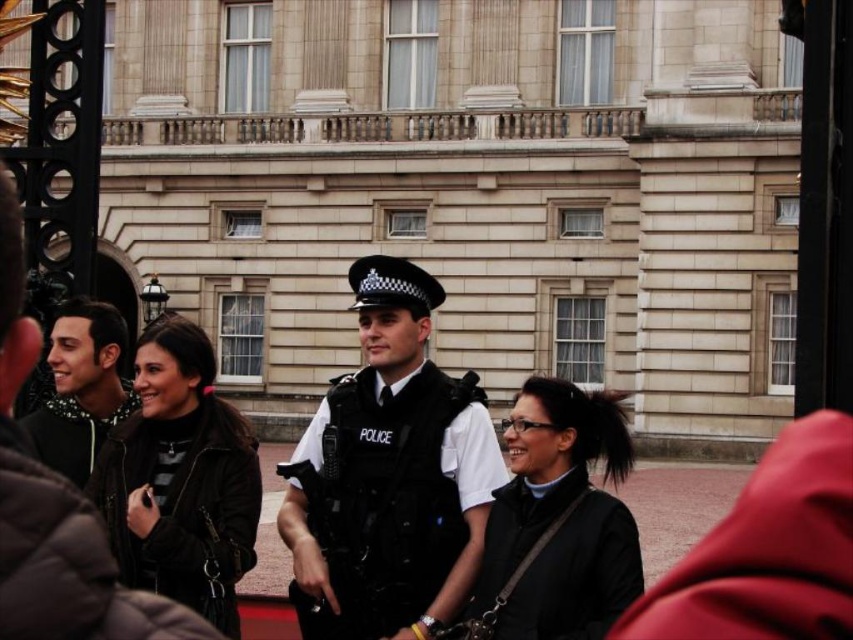
Is beige stone building at center shorter than matte black jacket at left?

No, beige stone building at center is not shorter than matte black jacket at left.

Can you confirm if beige stone building at center is positioned to the right of matte black jacket at left?

Indeed, beige stone building at center is positioned on the right side of matte black jacket at left.

Which is in front, point (306, 86) or point (112, 408)?

Positioned in front is point (112, 408).

Image resolution: width=853 pixels, height=640 pixels. Identify the location of beige stone building at center. (471, 193).

What do you see at coordinates (389, 476) in the screenshot?
I see `black uniformed police officer at center` at bounding box center [389, 476].

Who is positioned more to the right, black uniformed police officer at center or matte black jacket at left?

Positioned to the right is black uniformed police officer at center.

Who is more forward, (370, 323) or (59, 449)?

Point (59, 449) is more forward.

You are a GUI agent. You are given a task and a screenshot of the screen. Output one action in this format:
    pyautogui.click(x=<x>, y=<y>)
    Task: Click on the black uniformed police officer at center
    The image size is (853, 640).
    Given the screenshot: What is the action you would take?
    pyautogui.click(x=389, y=476)

Does beige stone building at center have a lesser height compared to black uniformed police officer at center?

No, beige stone building at center is not shorter than black uniformed police officer at center.

Does point (654, 4) come farther from viewer compared to point (416, 627)?

Yes, it is behind point (416, 627).

Which is behind, point (399, 84) or point (409, 278)?

Point (399, 84)

Locate an element on the screen. beige stone building at center is located at coordinates tap(471, 193).